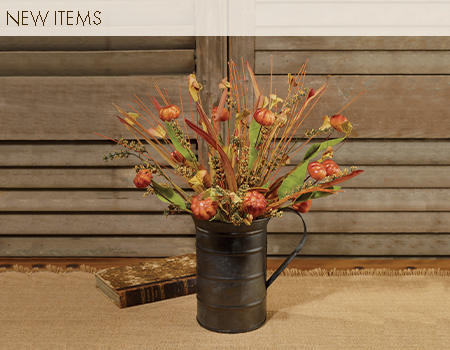
At what (x,y) coordinates should I click in order to perform the action: click on woven mat. Please return your answer as a coordinate pair (x, y). Looking at the image, I should click on (75, 284).